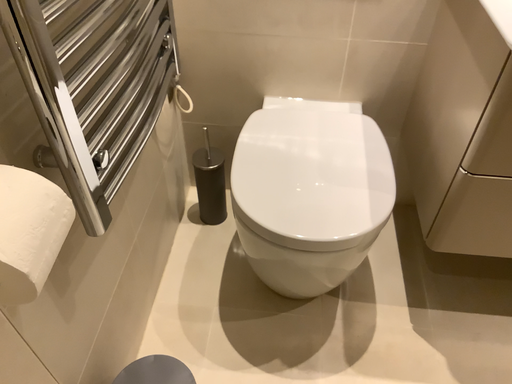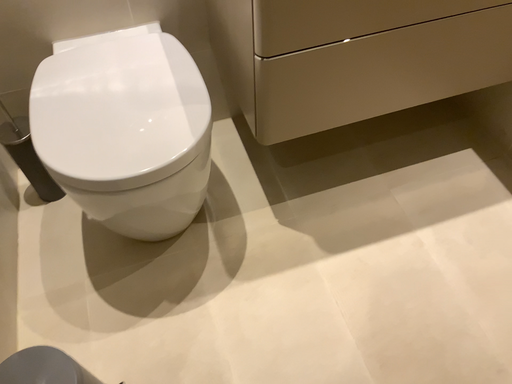
Question: Which way did the camera rotate in the video?

Choices:
 (A) rotated right
 (B) rotated left

Answer: (A)